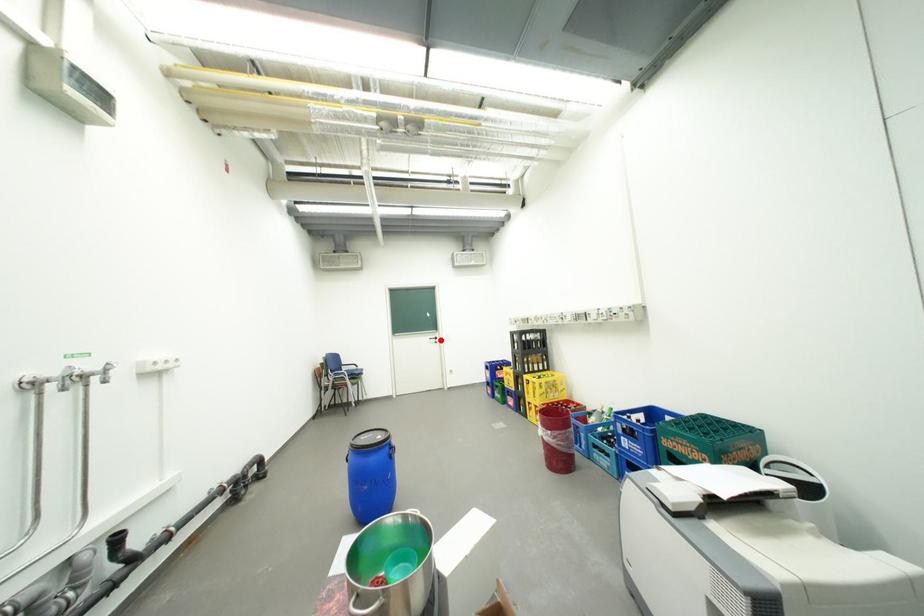
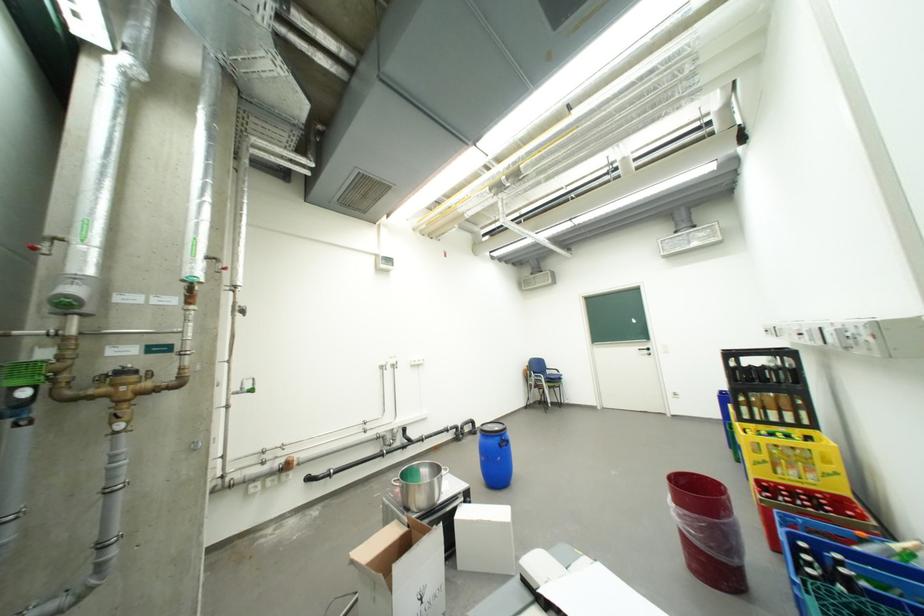
Locate, in the second image, the point that corresponds to the highlighted location in the first image.

(650, 351)